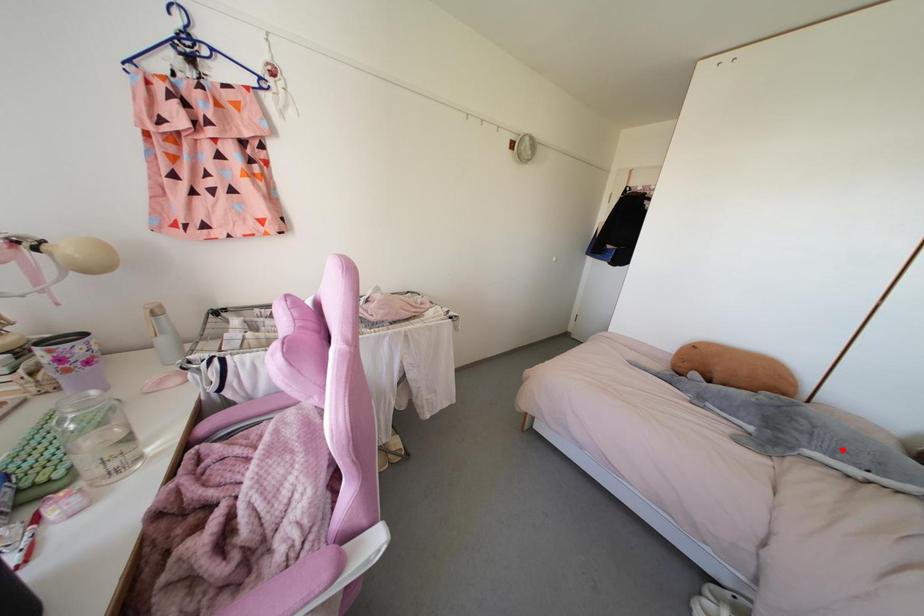
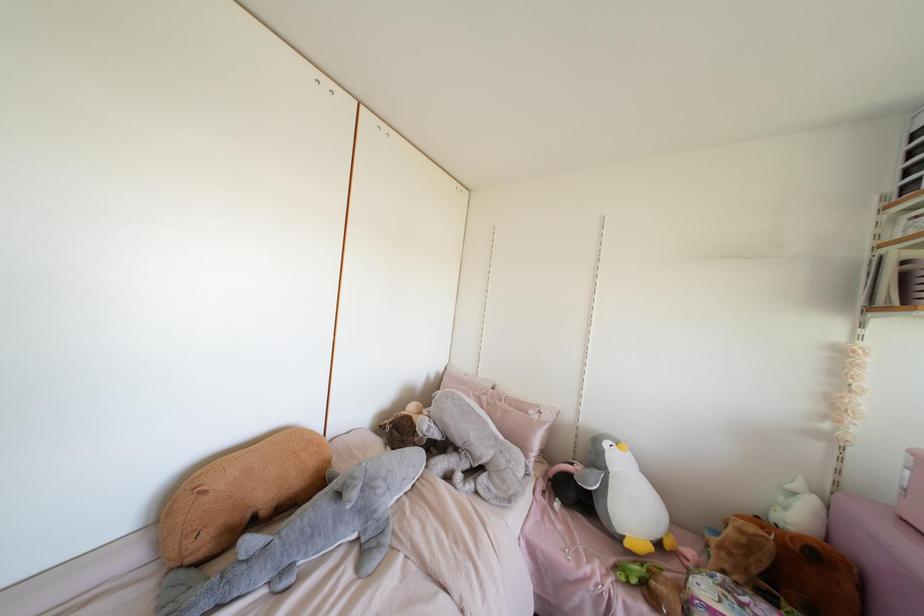
Locate, in the second image, the point that corresponds to the highlighted location in the first image.

(403, 479)